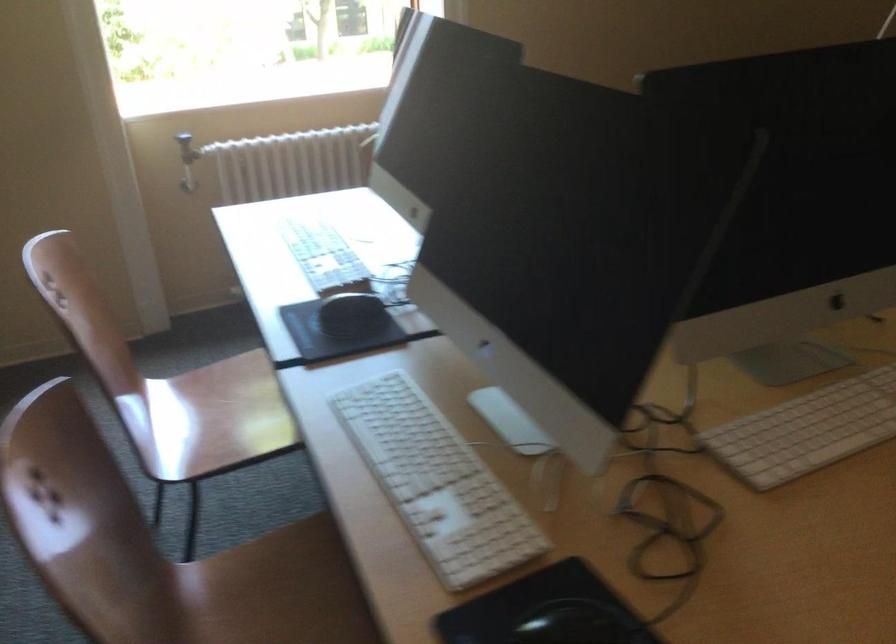
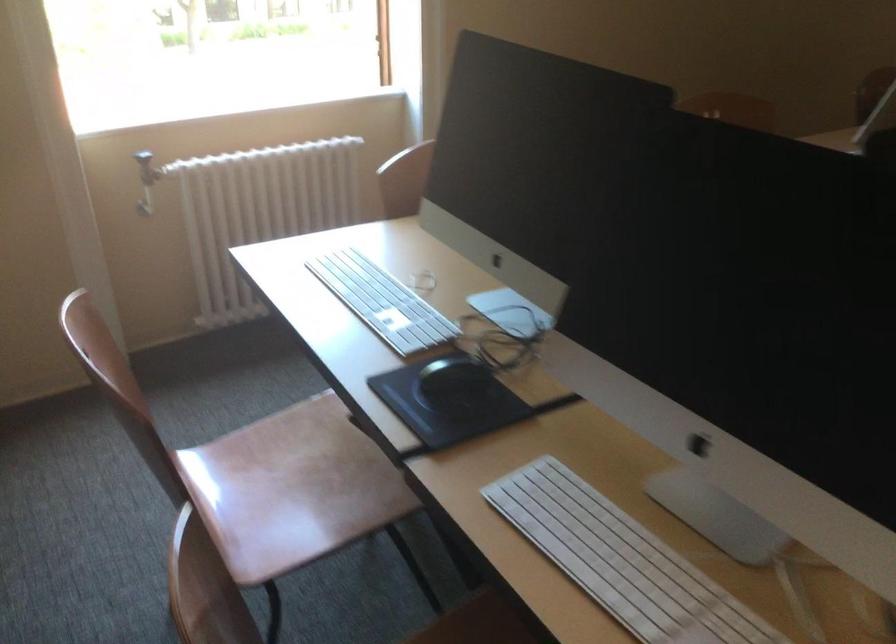
Where in the second image is the point corresponding to [234,412] from the first image?

(291, 488)